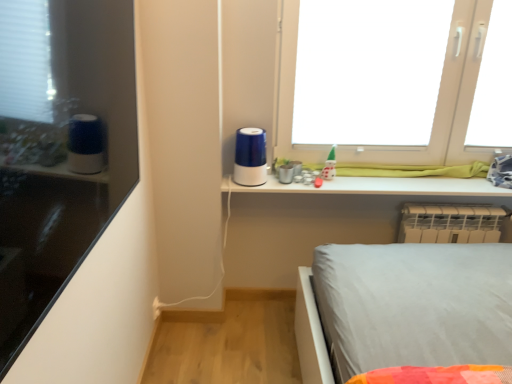
This screenshot has height=384, width=512. Identify the location of white plastic window at upper right. (446, 99).

The width and height of the screenshot is (512, 384). What do you see at coordinates (494, 84) in the screenshot? I see `transparent plastic window screen at upper right` at bounding box center [494, 84].

The height and width of the screenshot is (384, 512). In order to click on green glossy toy at upper center in this screenshot , I will do `click(329, 165)`.

Find the location of a particular element. white plastic window at upper right is located at coordinates (446, 99).

Consider the image. Is transparent plastic window screen at upper right not within white plastic radiator at lower right?

Indeed, transparent plastic window screen at upper right is completely outside white plastic radiator at lower right.

Does point (484, 119) come behind point (442, 208)?

No, (484, 119) is in front of (442, 208).

In the scene shown: Who is taller, transparent plastic window screen at upper right or white plastic radiator at lower right?

With more height is transparent plastic window screen at upper right.

Considering the positions of objects transparent plastic window screen at upper right and white plastic radiator at lower right in the image provided, who is more to the left, transparent plastic window screen at upper right or white plastic radiator at lower right?

Positioned to the left is white plastic radiator at lower right.

Are green glossy toy at upper center and matte black shelf at left far apart?

green glossy toy at upper center is far away from matte black shelf at left.

Which object is more forward, green glossy toy at upper center or matte black shelf at left?

Positioned in front is matte black shelf at left.

Considering the relative sizes of green glossy toy at upper center and matte black shelf at left in the image provided, is green glossy toy at upper center thinner than matte black shelf at left?

Indeed, green glossy toy at upper center has a lesser width compared to matte black shelf at left.

In the image, is white plastic window at upper right on the left side or the right side of matte black shelf at left?

white plastic window at upper right is to the right of matte black shelf at left.

Can you tell me how much white plastic window at upper right and matte black shelf at left differ in facing direction?

white plastic window at upper right and matte black shelf at left are facing 89.8 degrees away from each other.

Which is in front, white plastic window at upper right or matte black shelf at left?

matte black shelf at left.

From a real-world perspective, who is located lower, white plastic window at upper right or matte black shelf at left?

From a 3D spatial view, white plastic window at upper right is below.

In the scene shown: Considering the positions of objects white plastic radiator at lower right and white plastic window at upper right in the image provided, who is more to the right, white plastic radiator at lower right or white plastic window at upper right?

white plastic radiator at lower right is more to the right.

From a real-world perspective, is white plastic radiator at lower right physically located above or below white plastic window at upper right?

white plastic radiator at lower right is situated lower than white plastic window at upper right in the real world.

Is white plastic radiator at lower right further to the viewer compared to white plastic window at upper right?

Yes, white plastic radiator at lower right is behind white plastic window at upper right.

Image resolution: width=512 pixels, height=384 pixels. I want to click on radiator behind the white plastic window at upper right, so [x=450, y=223].

Is white plastic radiator at lower right at the back of white plastic window at upper right?

white plastic window at upper right does not have its back to white plastic radiator at lower right.

Is white plastic window at upper right directly adjacent to white plastic radiator at lower right?

There is a gap between white plastic window at upper right and white plastic radiator at lower right.

Can we say white plastic window at upper right lies outside white plastic radiator at lower right?

Yes, white plastic window at upper right is not within white plastic radiator at lower right.

Is white plastic radiator at lower right not near blue glossy humidifier at center?

No, there isn't a large distance between white plastic radiator at lower right and blue glossy humidifier at center.

Image resolution: width=512 pixels, height=384 pixels. Identify the location of appliance in front of the white plastic radiator at lower right. (250, 157).

Could you tell me if white plastic radiator at lower right is facing blue glossy humidifier at center?

No, white plastic radiator at lower right does not turn towards blue glossy humidifier at center.

Which object is wider, white plastic radiator at lower right or green glossy toy at upper center?

Wider between the two is white plastic radiator at lower right.

Does white plastic radiator at lower right appear on the right side of green glossy toy at upper center?

Yes, white plastic radiator at lower right is to the right of green glossy toy at upper center.

Do you think white plastic radiator at lower right is within green glossy toy at upper center, or outside of it?

white plastic radiator at lower right lies outside green glossy toy at upper center.

Where is `window screen located in front of the white plastic radiator at lower right`? window screen located in front of the white plastic radiator at lower right is located at coordinates (494, 84).

Where is `toy behind the matte black shelf at left`? The image size is (512, 384). toy behind the matte black shelf at left is located at coordinates (329, 165).

When comparing their distances from white plastic window at upper right, does green glossy toy at upper center or white plastic radiator at lower right seem further?

green glossy toy at upper center lies further to white plastic window at upper right than the other object.

Considering their positions, is white plastic window at upper right positioned further to matte black shelf at left than blue glossy humidifier at center?

white plastic window at upper right is positioned further to the anchor matte black shelf at left.

When comparing their distances from blue glossy humidifier at center, does green glossy toy at upper center or white plastic radiator at lower right seem closer?

green glossy toy at upper center is positioned closer to the anchor blue glossy humidifier at center.

Looking at the image, which one is located closer to white plastic window at upper right, white plastic radiator at lower right or transparent plastic window screen at upper right?

transparent plastic window screen at upper right is positioned closer to the anchor white plastic window at upper right.

Based on their spatial positions, is white plastic radiator at lower right or blue glossy humidifier at center further from green glossy toy at upper center?

white plastic radiator at lower right is further to green glossy toy at upper center.

Estimate the real-world distances between objects in this image. Which object is further from white plastic radiator at lower right, matte black shelf at left or green glossy toy at upper center?

matte black shelf at left lies further to white plastic radiator at lower right than the other object.

Estimate the real-world distances between objects in this image. Which object is further from green glossy toy at upper center, white plastic radiator at lower right or transparent plastic window screen at upper right?

transparent plastic window screen at upper right.

Based on their spatial positions, is green glossy toy at upper center or matte black shelf at left further from white plastic radiator at lower right?

Among the two, matte black shelf at left is located further to white plastic radiator at lower right.

Find the location of `appliance between matte black shelf at left and white plastic radiator at lower right along the z-axis`. appliance between matte black shelf at left and white plastic radiator at lower right along the z-axis is located at coordinates (250, 157).

This screenshot has width=512, height=384. In order to click on radiator situated between blue glossy humidifier at center and transparent plastic window screen at upper right from left to right in this screenshot , I will do `click(450, 223)`.

What are the coordinates of `window located between matte black shelf at left and transparent plastic window screen at upper right in the depth direction` in the screenshot? It's located at (446, 99).

The width and height of the screenshot is (512, 384). In order to click on toy between blue glossy humidifier at center and white plastic radiator at lower right in this screenshot , I will do `click(329, 165)`.